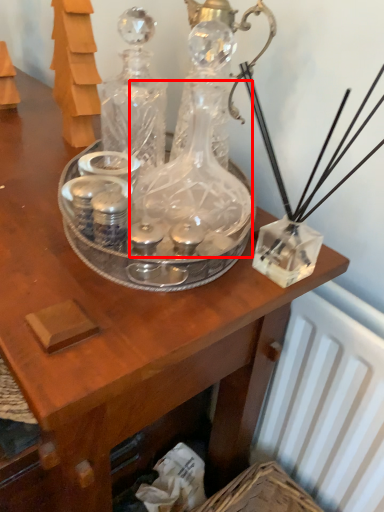
Question: Where is glass bottle (annotated by the red box) located in relation to glass bottle in the image?

Choices:
 (A) right
 (B) left

Answer: (A)